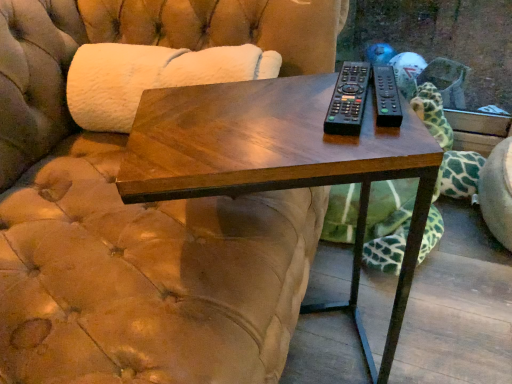
Question: Should I look upward or downward to see green spotted fabric at right?

Choices:
 (A) up
 (B) down

Answer: (A)

Question: Is black plastic remote at center, positioned as the 1th remote in right-to-left order, not inside green spotted fabric at right?

Choices:
 (A) yes
 (B) no

Answer: (A)

Question: Considering the relative sizes of black plastic remote at center, acting as the second remote starting from the left, and green spotted fabric at right in the image provided, is black plastic remote at center, acting as the second remote starting from the left, bigger than green spotted fabric at right?

Choices:
 (A) no
 (B) yes

Answer: (A)

Question: Is black plastic remote at center, positioned as the 1th remote in right-to-left order, facing towards green spotted fabric at right?

Choices:
 (A) yes
 (B) no

Answer: (B)

Question: Is black plastic remote at center, acting as the second remote starting from the left, facing away from green spotted fabric at right?

Choices:
 (A) yes
 (B) no

Answer: (B)

Question: Can you confirm if black plastic remote at center, acting as the second remote starting from the left, is shorter than green spotted fabric at right?

Choices:
 (A) no
 (B) yes

Answer: (B)

Question: Can you confirm if black plastic remote at center, acting as the second remote starting from the left, is positioned to the right of green spotted fabric at right?

Choices:
 (A) yes
 (B) no

Answer: (B)

Question: Is black plastic remote at center, the first remote when ordered from left to right, closer to the viewer compared to green spotted fabric at right?

Choices:
 (A) yes
 (B) no

Answer: (A)

Question: From the image's perspective, is black plastic remote at center, the first remote when ordered from left to right, located above green spotted fabric at right?

Choices:
 (A) no
 (B) yes

Answer: (B)

Question: Considering the relative sizes of black plastic remote at center, the first remote when ordered from left to right, and green spotted fabric at right in the image provided, is black plastic remote at center, the first remote when ordered from left to right, thinner than green spotted fabric at right?

Choices:
 (A) yes
 (B) no

Answer: (A)

Question: From a real-world perspective, does black plastic remote at center, the first remote when ordered from left to right, sit lower than green spotted fabric at right?

Choices:
 (A) yes
 (B) no

Answer: (B)

Question: Can you see black plastic remote at center, the first remote when ordered from left to right, touching green spotted fabric at right?

Choices:
 (A) yes
 (B) no

Answer: (B)

Question: Is black plastic remote at center, the first remote when ordered from left to right, to the right of green spotted fabric at right from the viewer's perspective?

Choices:
 (A) yes
 (B) no

Answer: (B)

Question: Is green spotted fabric at right not near black plastic remote at center, acting as the second remote starting from the left?

Choices:
 (A) no
 (B) yes

Answer: (A)